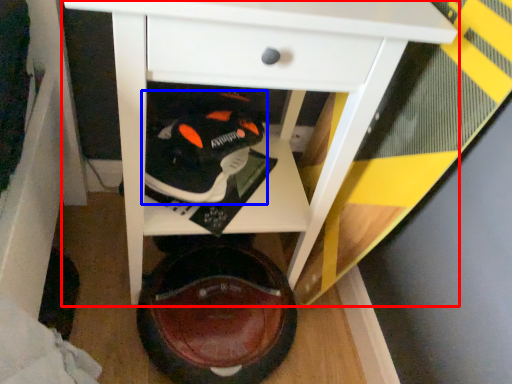
Question: Which of the following is the closest to the observer, table (highlighted by a red box) or footwear (highlighted by a blue box)?

Choices:
 (A) table
 (B) footwear

Answer: (A)